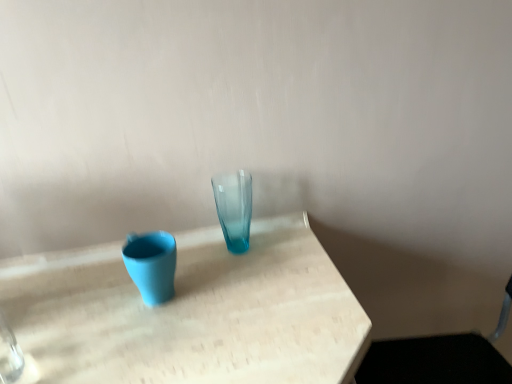
Locate an element on the screen. The height and width of the screenshot is (384, 512). translucent glass vase at center, marked as the 2th vase in a left-to-right arrangement is located at coordinates 234,208.

Identify the location of metallic silver swivel chair at lower right. (439, 358).

Find the location of a particular element. This screenshot has width=512, height=384. matte blue vase at left, the 2th vase viewed from the right is located at coordinates (151, 265).

You are a GUI agent. You are given a task and a screenshot of the screen. Output one action in this format:
    pyautogui.click(x=<x>, y=<y>)
    Task: Click on the translucent glass vase at center, the 1th vase in the right-to-left sequence
    This screenshot has height=384, width=512.
    Given the screenshot: What is the action you would take?
    pyautogui.click(x=234, y=208)

From a real-world perspective, is translucent glass vase at center, marked as the 2th vase in a left-to-right arrangement, physically located above or below matte blue vase at left, the 1th vase from the left?

translucent glass vase at center, marked as the 2th vase in a left-to-right arrangement, is above matte blue vase at left, the 1th vase from the left.

Which is farther from the camera, (x=219, y=195) or (x=153, y=238)?

Positioned behind is point (x=219, y=195).

How different are the orientations of translucent glass vase at center, the 1th vase in the right-to-left sequence, and matte blue vase at left, the 1th vase from the left, in degrees?

0.00529 degrees.

Is translucent glass vase at center, marked as the 2th vase in a left-to-right arrangement, with matte blue vase at left, the 2th vase viewed from the right?

No, translucent glass vase at center, marked as the 2th vase in a left-to-right arrangement, is not touching matte blue vase at left, the 2th vase viewed from the right.

Which object is wider, matte blue vase at left, the 2th vase viewed from the right, or translucent glass vase at center, marked as the 2th vase in a left-to-right arrangement?

matte blue vase at left, the 2th vase viewed from the right.

Considering the positions of points (163, 300) and (234, 193), is point (163, 300) farther from camera compared to point (234, 193)?

That is False.

Would you consider matte blue vase at left, the 1th vase from the left, to be distant from translucent glass vase at center, the 1th vase in the right-to-left sequence?

That's not correct — matte blue vase at left, the 1th vase from the left, is a little close to translucent glass vase at center, the 1th vase in the right-to-left sequence.

From a real-world perspective, who is located higher, matte blue vase at left, the 2th vase viewed from the right, or translucent glass vase at center, the 1th vase in the right-to-left sequence?

translucent glass vase at center, the 1th vase in the right-to-left sequence, is physically above.

Are metallic silver swivel chair at lower right and matte blue vase at left, the 1th vase from the left, making contact?

No, metallic silver swivel chair at lower right is not making contact with matte blue vase at left, the 1th vase from the left.

Between metallic silver swivel chair at lower right and matte blue vase at left, the 1th vase from the left, which one has larger size?

With larger size is metallic silver swivel chair at lower right.

Does metallic silver swivel chair at lower right appear on the right side of matte blue vase at left, the 2th vase viewed from the right?

Indeed, metallic silver swivel chair at lower right is positioned on the right side of matte blue vase at left, the 2th vase viewed from the right.

Considering the relative sizes of metallic silver swivel chair at lower right and matte blue vase at left, the 2th vase viewed from the right, in the image provided, is metallic silver swivel chair at lower right thinner than matte blue vase at left, the 2th vase viewed from the right,?

In fact, metallic silver swivel chair at lower right might be wider than matte blue vase at left, the 2th vase viewed from the right.

Can you confirm if matte blue vase at left, the 2th vase viewed from the right, is bigger than metallic silver swivel chair at lower right?

Actually, matte blue vase at left, the 2th vase viewed from the right, might be smaller than metallic silver swivel chair at lower right.

Would you say matte blue vase at left, the 1th vase from the left, is a long distance from metallic silver swivel chair at lower right?

No.

Does point (159, 231) come closer to viewer compared to point (422, 373)?

Yes, it is in front of point (422, 373).

From a real-world perspective, which object stands above the other?

matte blue vase at left, the 1th vase from the left.

Which is in front, metallic silver swivel chair at lower right or translucent glass vase at center, the 1th vase in the right-to-left sequence?

metallic silver swivel chair at lower right.

From the image's perspective, which is below, metallic silver swivel chair at lower right or translucent glass vase at center, the 1th vase in the right-to-left sequence?

metallic silver swivel chair at lower right appears lower in the image.

Is metallic silver swivel chair at lower right in contact with translucent glass vase at center, marked as the 2th vase in a left-to-right arrangement?

metallic silver swivel chair at lower right is not next to translucent glass vase at center, marked as the 2th vase in a left-to-right arrangement, and they're not touching.

Can you confirm if metallic silver swivel chair at lower right is taller than translucent glass vase at center, marked as the 2th vase in a left-to-right arrangement?

Yes, metallic silver swivel chair at lower right is taller than translucent glass vase at center, marked as the 2th vase in a left-to-right arrangement.

Image resolution: width=512 pixels, height=384 pixels. I want to click on vase that is the 2nd object located behind the metallic silver swivel chair at lower right, so click(234, 208).

Is translucent glass vase at center, marked as the 2th vase in a left-to-right arrangement, at the left side of metallic silver swivel chair at lower right?

Yes.

How much distance is there between translucent glass vase at center, the 1th vase in the right-to-left sequence, and metallic silver swivel chair at lower right?

translucent glass vase at center, the 1th vase in the right-to-left sequence, and metallic silver swivel chair at lower right are 18.77 inches apart.

Is point (229, 224) farther from camera compared to point (401, 357)?

No.

Where is `vase on the left of translucent glass vase at center, the 1th vase in the right-to-left sequence`? The width and height of the screenshot is (512, 384). vase on the left of translucent glass vase at center, the 1th vase in the right-to-left sequence is located at coordinates (151, 265).

This screenshot has height=384, width=512. What are the coordinates of `vase in front of the translucent glass vase at center, marked as the 2th vase in a left-to-right arrangement` in the screenshot? It's located at (151, 265).

Looking at the image, which one is located closer to metallic silver swivel chair at lower right, matte blue vase at left, the 1th vase from the left, or translucent glass vase at center, marked as the 2th vase in a left-to-right arrangement?

translucent glass vase at center, marked as the 2th vase in a left-to-right arrangement, lies closer to metallic silver swivel chair at lower right than the other object.

Estimate the real-world distances between objects in this image. Which object is further from translucent glass vase at center, the 1th vase in the right-to-left sequence, metallic silver swivel chair at lower right or matte blue vase at left, the 1th vase from the left?

The object further to translucent glass vase at center, the 1th vase in the right-to-left sequence, is metallic silver swivel chair at lower right.

Estimate the real-world distances between objects in this image. Which object is closer to metallic silver swivel chair at lower right, translucent glass vase at center, the 1th vase in the right-to-left sequence, or matte blue vase at left, the 2th vase viewed from the right?

The object closer to metallic silver swivel chair at lower right is translucent glass vase at center, the 1th vase in the right-to-left sequence.

In the scene shown: Considering their positions, is matte blue vase at left, the 2th vase viewed from the right, positioned further to translucent glass vase at center, marked as the 2th vase in a left-to-right arrangement, than metallic silver swivel chair at lower right?

The object further to translucent glass vase at center, marked as the 2th vase in a left-to-right arrangement, is metallic silver swivel chair at lower right.

From the picture: Estimate the real-world distances between objects in this image. Which object is closer to matte blue vase at left, the 2th vase viewed from the right, metallic silver swivel chair at lower right or translucent glass vase at center, marked as the 2th vase in a left-to-right arrangement?

The object closer to matte blue vase at left, the 2th vase viewed from the right, is translucent glass vase at center, marked as the 2th vase in a left-to-right arrangement.

In the scene shown: Which object lies nearer to the anchor point matte blue vase at left, the 1th vase from the left, translucent glass vase at center, the 1th vase in the right-to-left sequence, or metallic silver swivel chair at lower right?

The object closer to matte blue vase at left, the 1th vase from the left, is translucent glass vase at center, the 1th vase in the right-to-left sequence.

Locate an element on the screen. The width and height of the screenshot is (512, 384). vase located between matte blue vase at left, the 2th vase viewed from the right, and metallic silver swivel chair at lower right in the left-right direction is located at coordinates (234, 208).